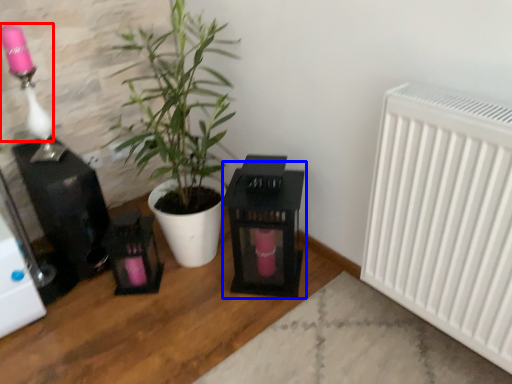
Question: Which object is closer to the camera taking this photo, lamp (highlighted by a red box) or table (highlighted by a blue box)?

Choices:
 (A) lamp
 (B) table

Answer: (A)